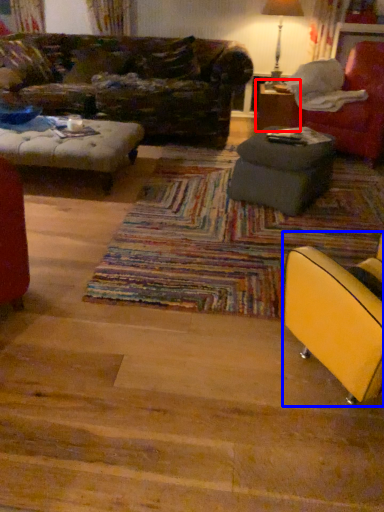
Question: Among these objects, which one is farthest to the camera, table (highlighted by a red box) or chair (highlighted by a blue box)?

Choices:
 (A) table
 (B) chair

Answer: (A)